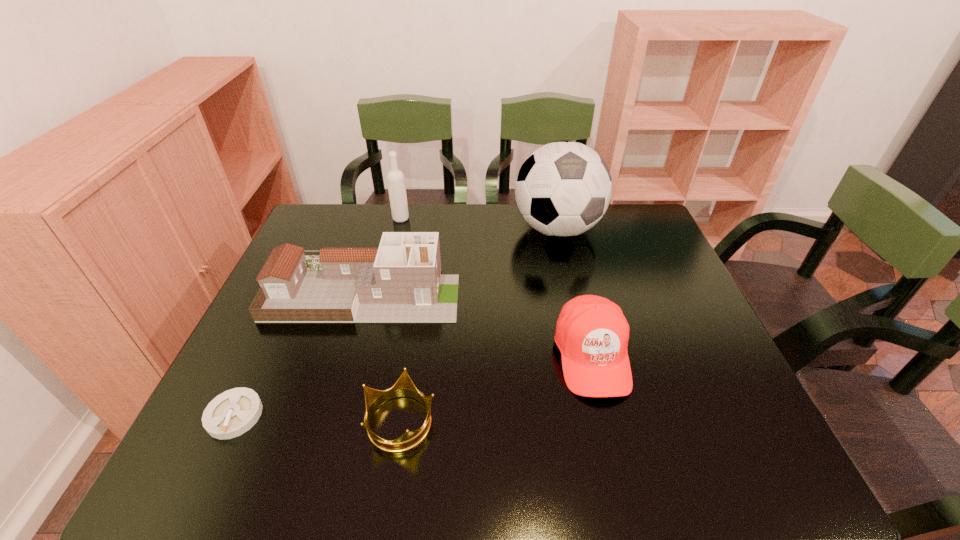
This screenshot has width=960, height=540. Identify the location of free space located on the right of the fifth tallest object. (470, 421).

Identify the location of vacant space located on the right of the ashtray. (324, 415).

You are a GUI agent. You are given a task and a screenshot of the screen. Output one action in this format:
    pyautogui.click(x=<x>, y=<y>)
    Task: Click on the soccer ball present at the far edge
    The width and height of the screenshot is (960, 540).
    Given the screenshot: What is the action you would take?
    pyautogui.click(x=563, y=189)

This screenshot has width=960, height=540. What are the coordinates of `vodka positioned at the far edge` in the screenshot? It's located at (x=395, y=178).

The height and width of the screenshot is (540, 960). I want to click on crown at the near edge, so click(404, 387).

Where is `ashtray located in the near edge section of the desktop`? The height and width of the screenshot is (540, 960). ashtray located in the near edge section of the desktop is located at coordinates (232, 413).

The height and width of the screenshot is (540, 960). I want to click on dollhouse situated at the left edge, so click(400, 282).

You are a GUI agent. You are given a task and a screenshot of the screen. Output one action in this format:
    pyautogui.click(x=<x>, y=<y>)
    Task: Click on the ashtray that is positioned at the left edge
    This screenshot has height=540, width=960.
    Given the screenshot: What is the action you would take?
    pyautogui.click(x=232, y=413)

At what (x,y) coordinates should I click in order to perform the action: click on object situated at the near left corner. Please return your answer as a coordinate pair (x, y). The image size is (960, 540). Looking at the image, I should click on (232, 413).

You are a GUI agent. You are given a task and a screenshot of the screen. Output one action in this format:
    pyautogui.click(x=<x>, y=<y>)
    Task: Click on the free location at the far edge of the desktop
    
    Given the screenshot: What is the action you would take?
    pyautogui.click(x=547, y=244)